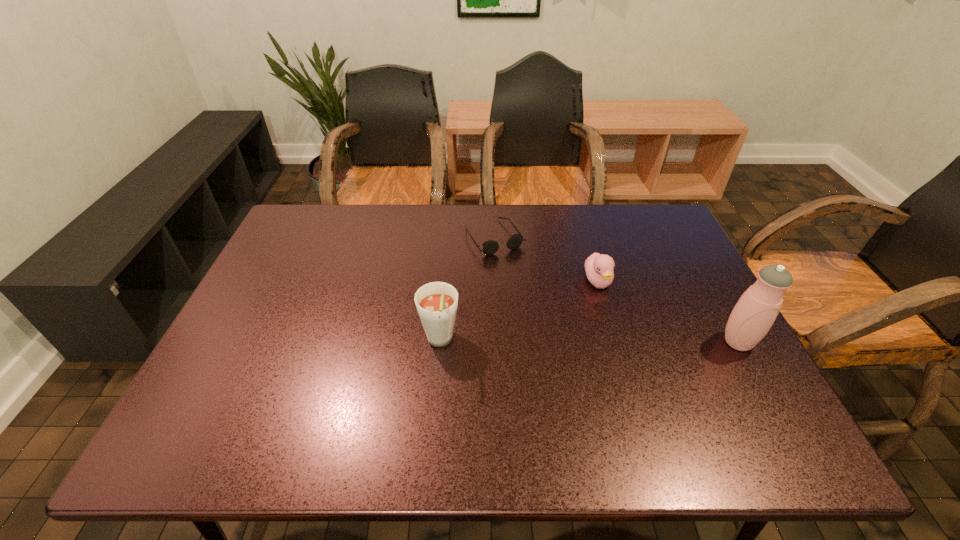
What are the coordinates of `vacant region located on the front-facing side of the second object from left to right` in the screenshot? It's located at (525, 282).

Identify the location of free space located 0.290m on the front-facing side of the second object from left to right. (555, 325).

Locate an element on the screen. The image size is (960, 540). free space located 0.240m on the front-facing side of the third tallest object is located at coordinates (646, 369).

Identify the location of vacant space located 0.200m on the front-facing side of the third tallest object. (638, 355).

The height and width of the screenshot is (540, 960). What are the coordinates of `free point located 0.160m on the front-facing side of the third tallest object` in the screenshot? It's located at (631, 342).

Locate an element on the screen. object located at the far edge is located at coordinates (490, 247).

Image resolution: width=960 pixels, height=540 pixels. In order to click on object that is at the right edge in this screenshot , I will do `click(755, 312)`.

The image size is (960, 540). In the image, there is a desktop. What are the coordinates of `vacant space at the far edge` in the screenshot? It's located at (612, 233).

Locate an element on the screen. The width and height of the screenshot is (960, 540). vacant space at the right edge of the desktop is located at coordinates (706, 322).

Find the location of a particular element. Image resolution: width=960 pixels, height=540 pixels. vacant area at the far left corner is located at coordinates (300, 207).